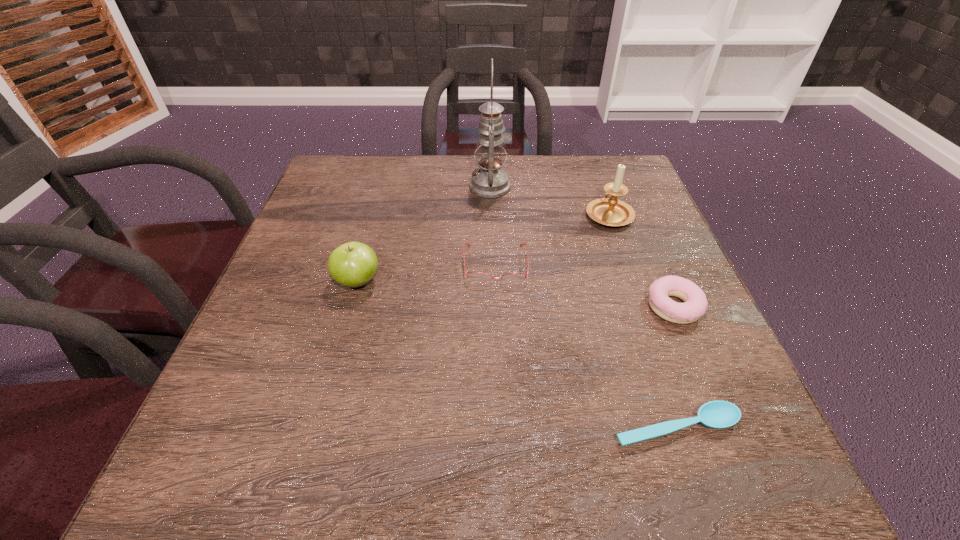
Locate an element on the screen. candle holder that is positioned at the right edge is located at coordinates (608, 211).

Image resolution: width=960 pixels, height=540 pixels. What are the coordinates of `doughnut that is at the right edge` in the screenshot? It's located at (695, 304).

The height and width of the screenshot is (540, 960). In order to click on spoon that is at the right edge in this screenshot , I will do `click(718, 414)`.

The image size is (960, 540). I want to click on object situated at the far right corner, so click(608, 211).

Where is `object at the near right corner`? object at the near right corner is located at coordinates (718, 414).

Locate an element on the screen. This screenshot has height=540, width=960. free space at the far edge of the desktop is located at coordinates (458, 198).

The height and width of the screenshot is (540, 960). Identify the location of free region at the near edge. (517, 486).

Where is `free space at the left edge`? free space at the left edge is located at coordinates (319, 282).

In the image, there is a desktop. In order to click on vacant space at the right edge in this screenshot , I will do `click(638, 278)`.

The height and width of the screenshot is (540, 960). What are the coordinates of `free spot at the near right corner of the desktop` in the screenshot? It's located at (775, 464).